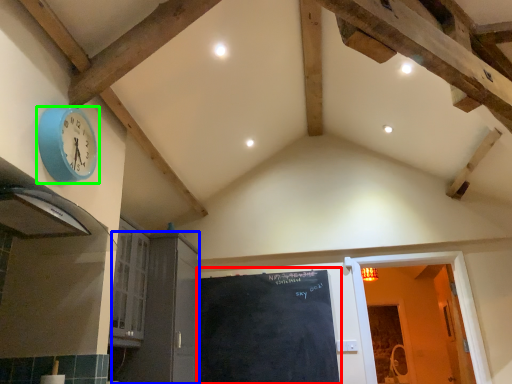
Question: Based on their relative distances, which object is farther from bulletin board (highlighted by a red box)? Choose from door (highlighted by a blue box) and wall clock (highlighted by a green box).

Choices:
 (A) door
 (B) wall clock

Answer: (B)